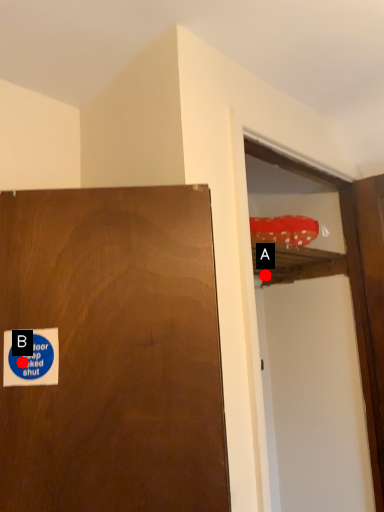
Question: Two points are circled on the image, labeled by A and B beside each circle. Which point appears farthest from the camera in this image?

Choices:
 (A) A is further
 (B) B is further

Answer: (A)